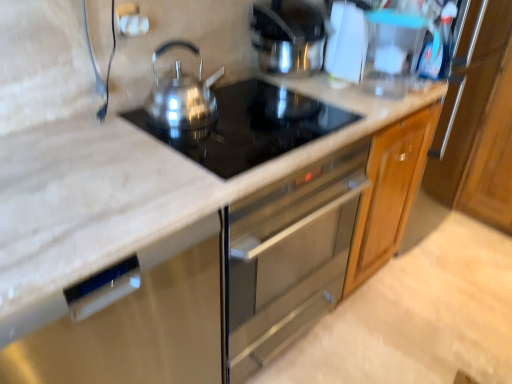
Question: Is transparent plastic pitcher at upper right situated inside black marble countertop at center or outside?

Choices:
 (A) inside
 (B) outside

Answer: (B)

Question: Based on their positions, is transparent plastic pitcher at upper right located to the left or right of black marble countertop at center?

Choices:
 (A) left
 (B) right

Answer: (B)

Question: Which is nearer to the satin silver dishwasher at center?

Choices:
 (A) satin silver kettle at upper center, which is the second kitchen appliance from front to back
 (B) satin black cooktop at center
 (C) satin silver kettle at center, arranged as the 1th kitchen appliance when viewed from the front
 (D) black marble countertop at center
 (E) transparent plastic pitcher at upper right

Answer: (D)

Question: Which object is the farthest from the satin black cooktop at center?

Choices:
 (A) black marble countertop at center
 (B) transparent plastic pitcher at upper right
 (C) satin silver kettle at upper center, the 1th kitchen appliance in the back-to-front sequence
 (D) satin silver kettle at center, which is the second kitchen appliance from right to left
 (E) satin silver dishwasher at center

Answer: (B)